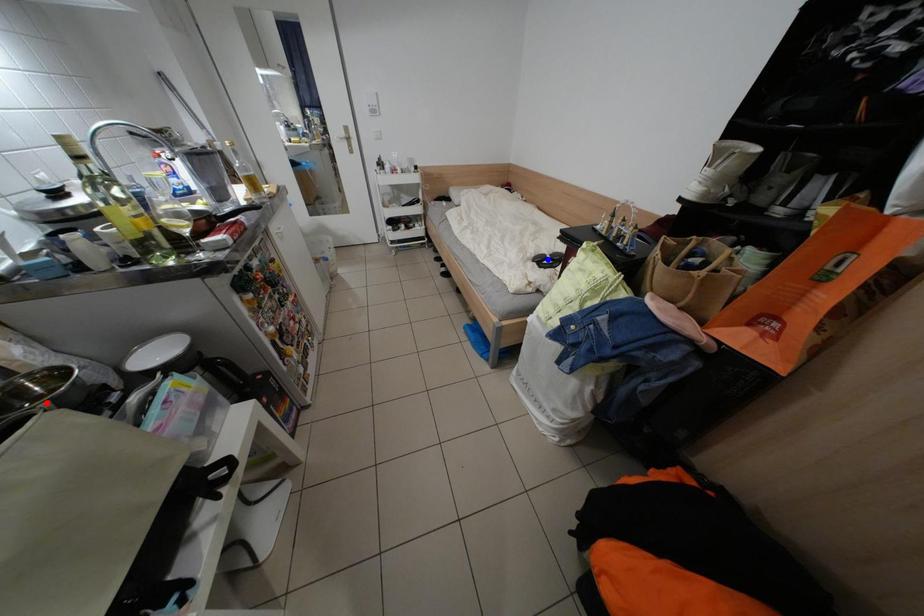
Question: Two points are marked on the image. Which point is closer to the camera?

Choices:
 (A) Blue point is closer.
 (B) Red point is closer.

Answer: (B)